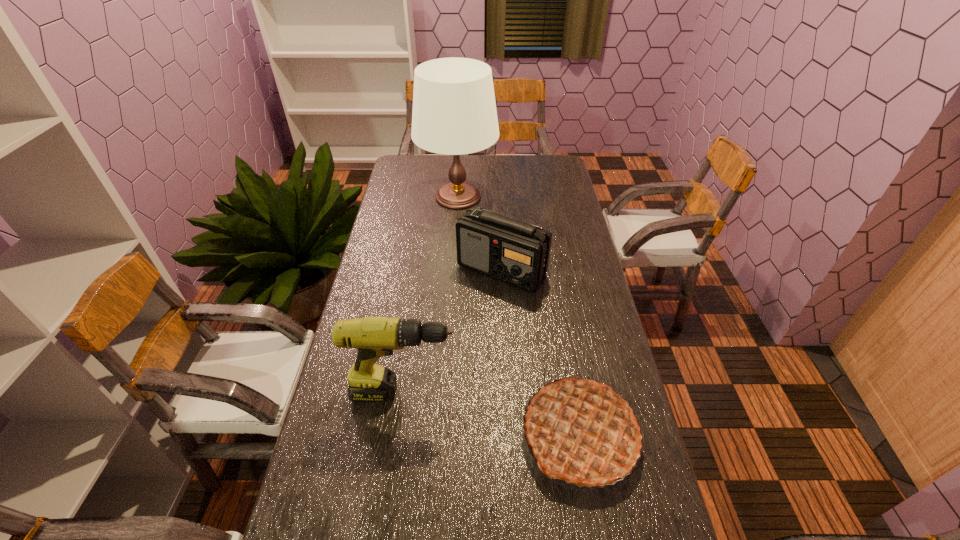
Locate an element on the screen. The width and height of the screenshot is (960, 540). the farthest object is located at coordinates (454, 112).

At what (x,y) coordinates should I click in order to perform the action: click on lamp. Please return your answer as a coordinate pair (x, y). This screenshot has width=960, height=540. Looking at the image, I should click on (454, 112).

Locate an element on the screen. The image size is (960, 540). drill is located at coordinates (374, 337).

At what (x,y) coordinates should I click in order to perform the action: click on radio receiver. Please return your answer as a coordinate pair (x, y). The height and width of the screenshot is (540, 960). Looking at the image, I should click on click(515, 252).

The width and height of the screenshot is (960, 540). Find the location of `pie`. pie is located at coordinates (581, 431).

What are the coordinates of `free space located 0.300m on the right of the lamp` in the screenshot? It's located at (565, 197).

Find the location of a particular element. Image resolution: width=960 pixels, height=540 pixels. free space located on the handle side of the drill is located at coordinates (588, 392).

At what (x,y) coordinates should I click in order to perform the action: click on vacant space located 0.150m on the front panel of the third nearest object. Please return your answer as a coordinate pair (x, y). This screenshot has width=960, height=540. Looking at the image, I should click on (505, 328).

The height and width of the screenshot is (540, 960). Identify the location of free location located on the left of the pie. (487, 436).

The height and width of the screenshot is (540, 960). I want to click on object present at the far edge, so click(454, 112).